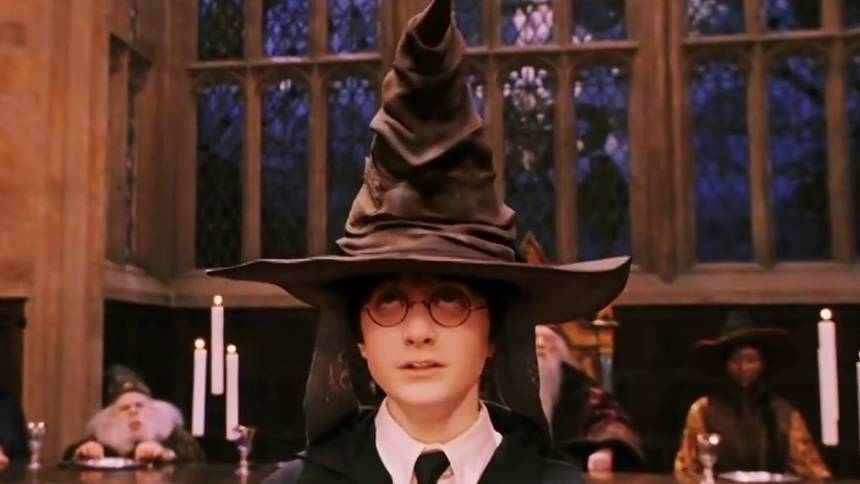
At what (x,y) coordinates should I click in order to perform the action: click on candles. Please return your answer as a coordinate pair (x, y). The height and width of the screenshot is (484, 860). Looking at the image, I should click on (194, 389), (219, 329), (234, 367), (830, 334), (35, 431).